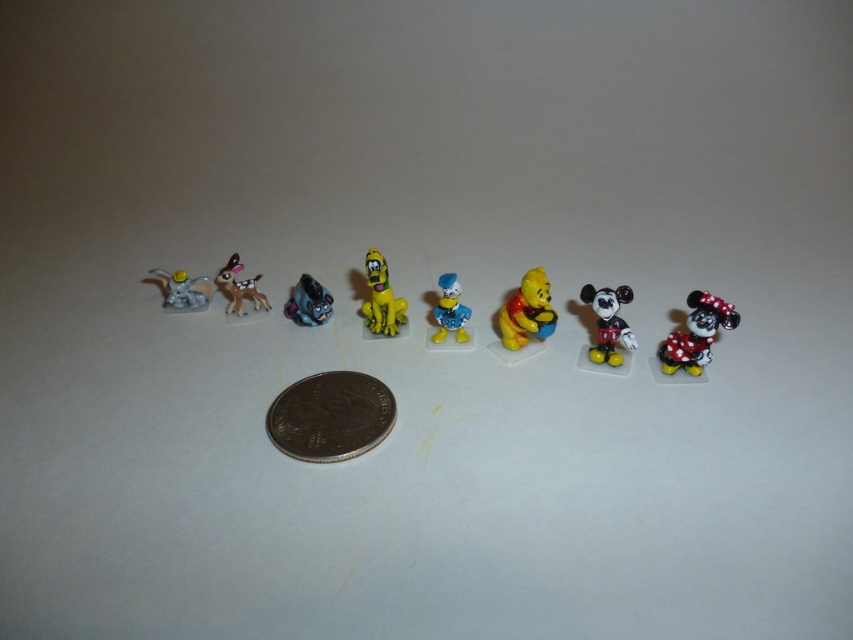
Question: Is the position of blue glossy donald duck at center less distant than that of brushed metal elephant at left?

Choices:
 (A) yes
 (B) no

Answer: (A)

Question: Considering the real-world distances, which object is farthest from the shiny black mouse at center?

Choices:
 (A) yellow matte winnie the pooh at center
 (B) matte plastic deer at left
 (C) brushed metal elephant at left

Answer: (C)

Question: Considering the relative positions of bronze metallic coin at center and blue glossy donald duck at center in the image provided, where is bronze metallic coin at center located with respect to blue glossy donald duck at center?

Choices:
 (A) above
 (B) below

Answer: (B)

Question: Is metallic blue robot at center bigger than blue glossy donald duck at center?

Choices:
 (A) no
 (B) yes

Answer: (B)

Question: Which of the following is the farthest from the observer?

Choices:
 (A) shiny black mouse at center
 (B) shiny plastic minnie mouse at right
 (C) bronze metallic coin at center

Answer: (A)

Question: Which point appears farthest from the camera in this image?

Choices:
 (A) (x=347, y=388)
 (B) (x=532, y=276)

Answer: (B)